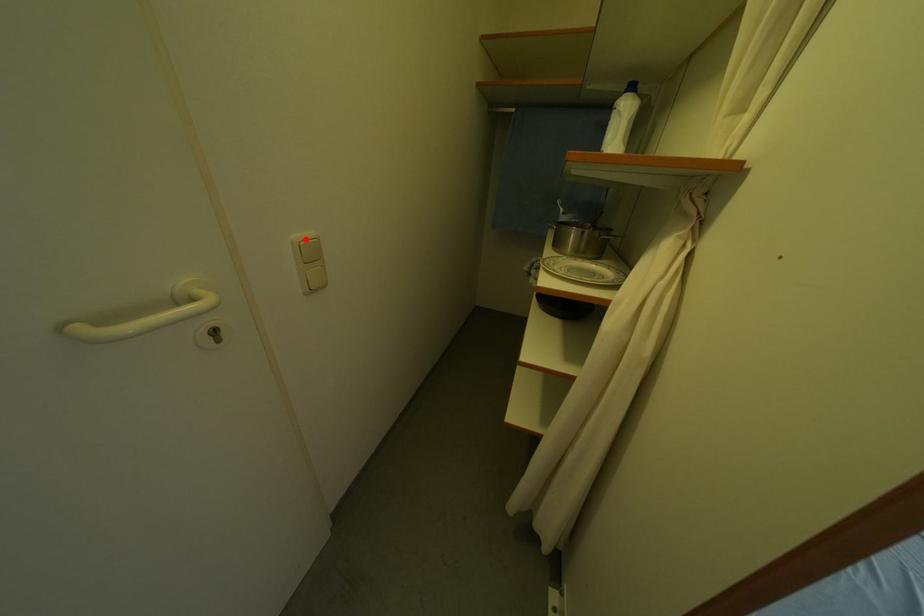
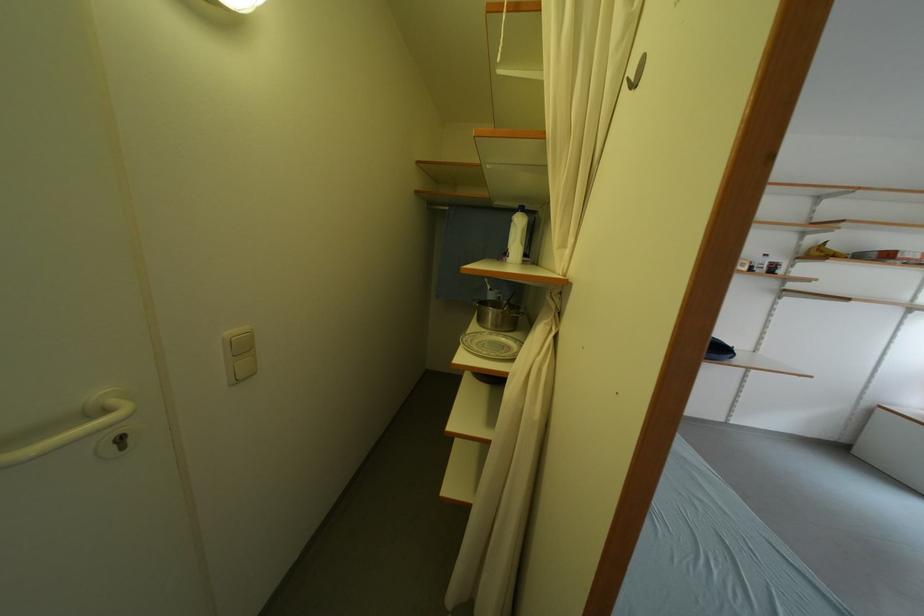
Where in the second image is the point corresponding to the highlighted location from the first image?

(237, 336)